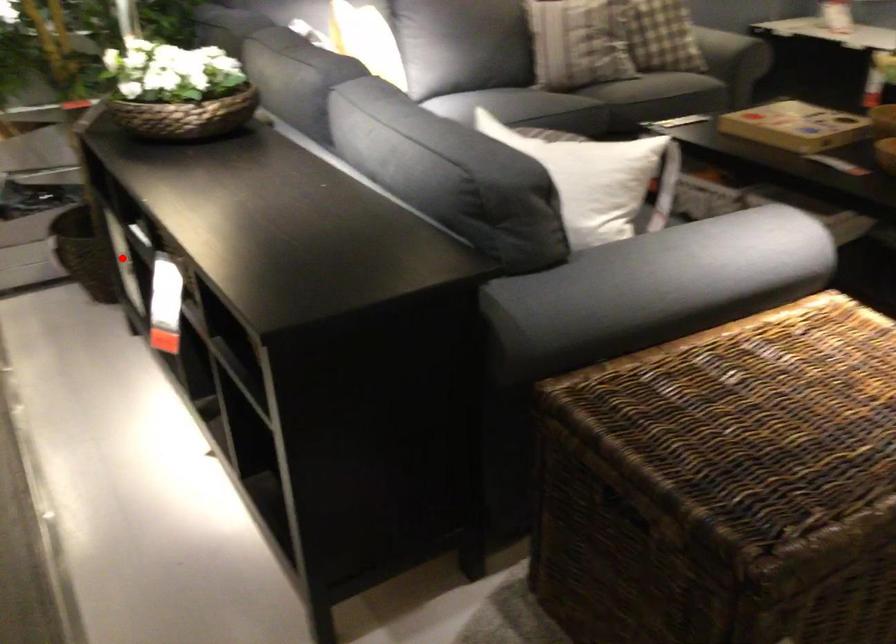
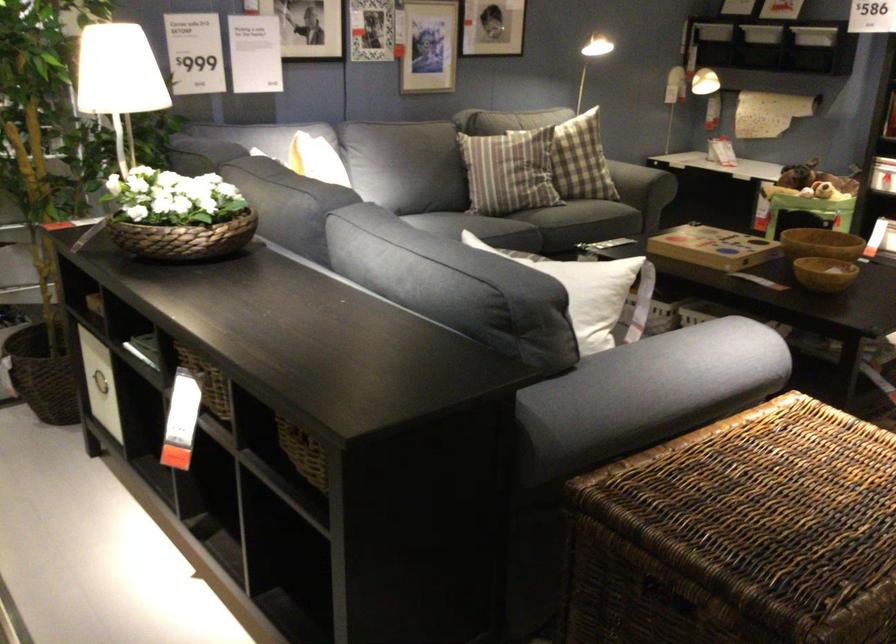
In the second image, find the point that corresponds to the highlighted location in the first image.

(99, 383)